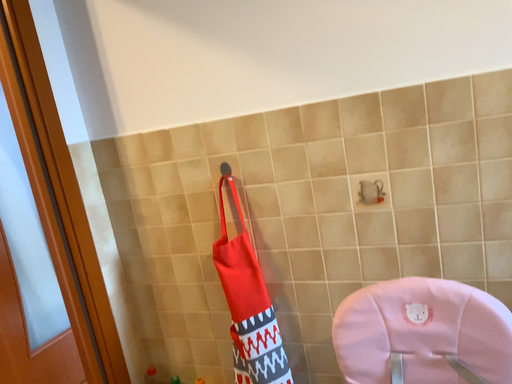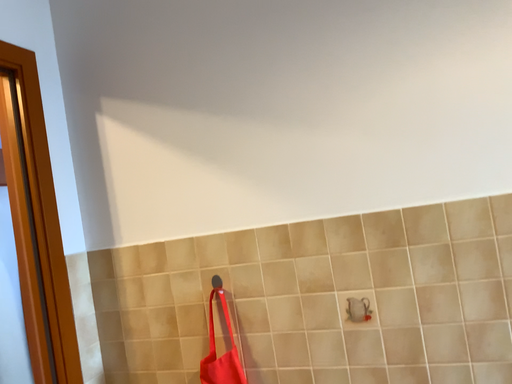
Question: How did the camera likely rotate when shooting the video?

Choices:
 (A) rotated downward
 (B) rotated upward

Answer: (B)